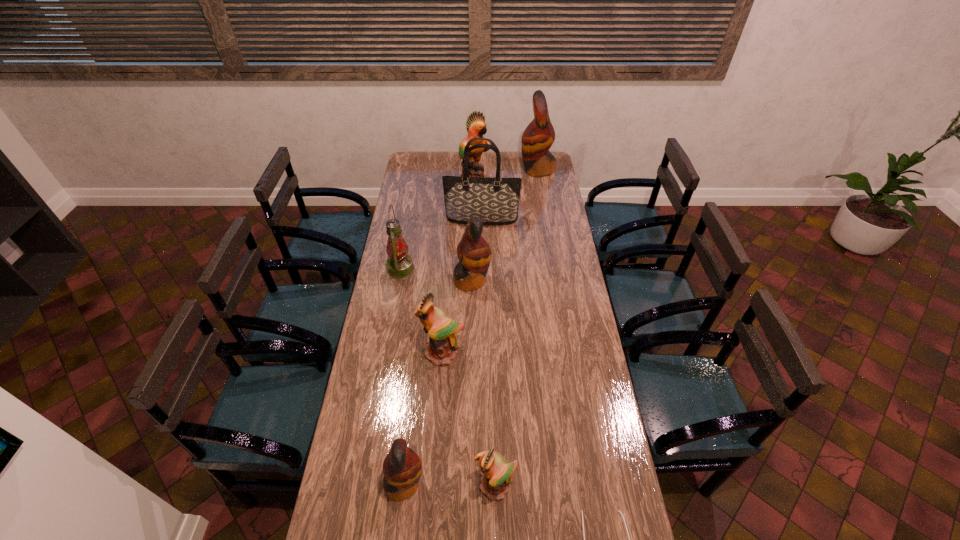
Locate an element on the screen. The image size is (960, 540). the biggest green parrot is located at coordinates (476, 126).

Image resolution: width=960 pixels, height=540 pixels. In order to click on the biggest red parrot in this screenshot , I will do `click(538, 137)`.

Locate an element on the screen. The height and width of the screenshot is (540, 960). the rightmost red parrot is located at coordinates (538, 137).

Identify the location of the seventh nearest object. The image size is (960, 540). (495, 200).

The height and width of the screenshot is (540, 960). Identify the location of black tote bag. (495, 200).

Where is `the fourth nearest parrot`? the fourth nearest parrot is located at coordinates (474, 253).

Identify the location of the second nearest red parrot. The width and height of the screenshot is (960, 540). (474, 253).

Find the location of a particular element. The height and width of the screenshot is (540, 960). the second smallest green parrot is located at coordinates (441, 346).

Locate an element on the screen. the fourth nearest object is located at coordinates (441, 346).

The height and width of the screenshot is (540, 960). I want to click on green oil lamp, so click(x=399, y=263).